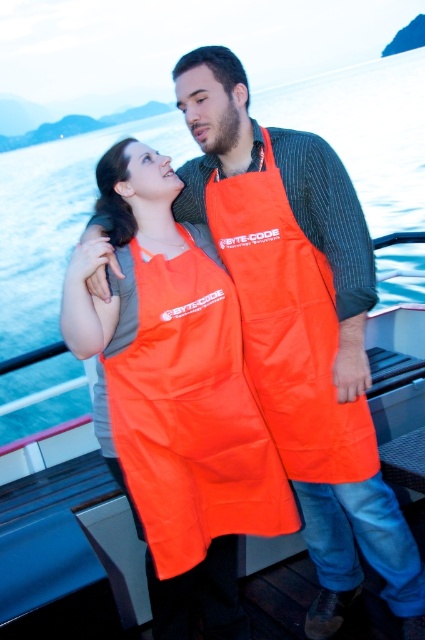
Question: From the image, what is the correct spatial relationship of orange matte apron at center in relation to orange fabric apron at center?

Choices:
 (A) above
 (B) below

Answer: (B)

Question: Which object is farther from the camera taking this photo?

Choices:
 (A) orange matte apron at center
 (B) orange fabric apron at center

Answer: (B)

Question: Does orange matte apron at center have a smaller size compared to orange fabric apron at center?

Choices:
 (A) no
 (B) yes

Answer: (A)

Question: Which point appears farthest from the camera in this image?

Choices:
 (A) (286, 508)
 (B) (342, 449)

Answer: (A)

Question: Observing the image, what is the correct spatial positioning of orange matte apron at center in reference to orange fabric apron at center?

Choices:
 (A) above
 (B) below

Answer: (B)